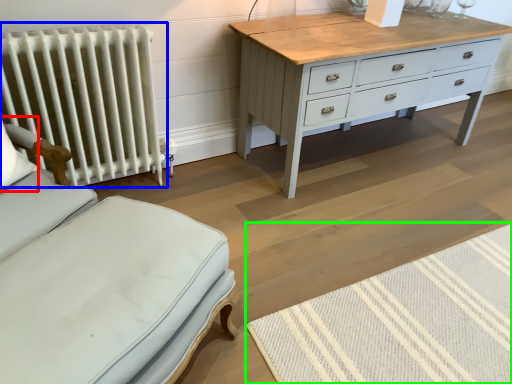
Question: Which object is the closest to the pillow (highlighted by a red box)? Choose among these: radiator (highlighted by a blue box) or mat (highlighted by a green box).

Choices:
 (A) radiator
 (B) mat

Answer: (A)